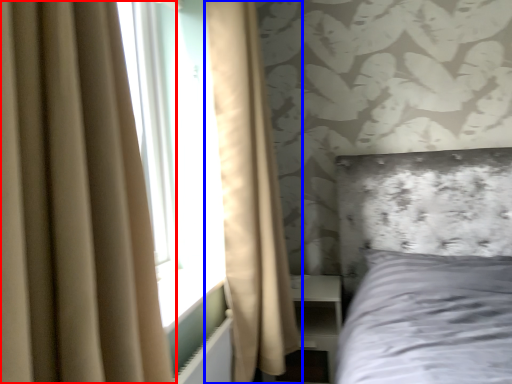
Question: Which point is closer to the camera, curtain (highlighted by a red box) or curtain (highlighted by a blue box)?

Choices:
 (A) curtain
 (B) curtain

Answer: (A)